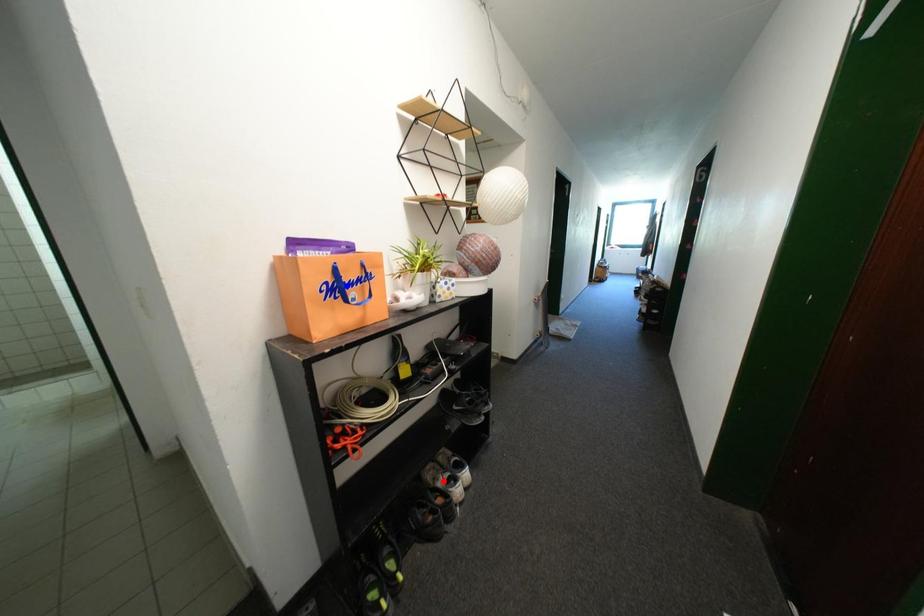
Question: In the image, two points are highlighted. Which point is nearer to the camera? Reply with the corresponding letter.

Choices:
 (A) blue point
 (B) red point

Answer: (A)